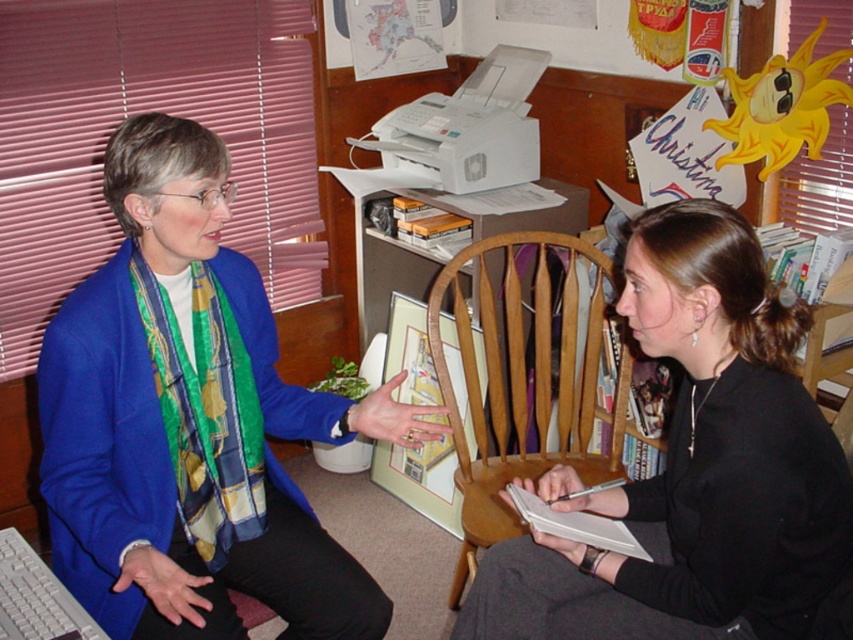
You are organizing a small meeting in this office and need to place a new laptop on the desk. The laptop requires at least 50 cm of space. Can the white plastic keyboard at lower left be moved to make space for the laptop without displacing the wooden chair at center?

The wooden chair at center is larger in size than the white plastic keyboard at lower left. Since the keyboard is smaller, it can be moved to make space for the laptop without affecting the chair.

You are standing in the office and want to reach both the point at coordinates (131, 461) and the point at coordinates (662, 269). Which point should you approach first to reach the closer one?

You should approach point (131, 461) first because it is closer to you than point (662, 269).

You are standing in the office and want to take a photo of the point at coordinates (457, 570). Is this point within the camera frame?

The point at coordinates (457, 570) is 2.41 meters away from the camera, so it is within the camera frame.